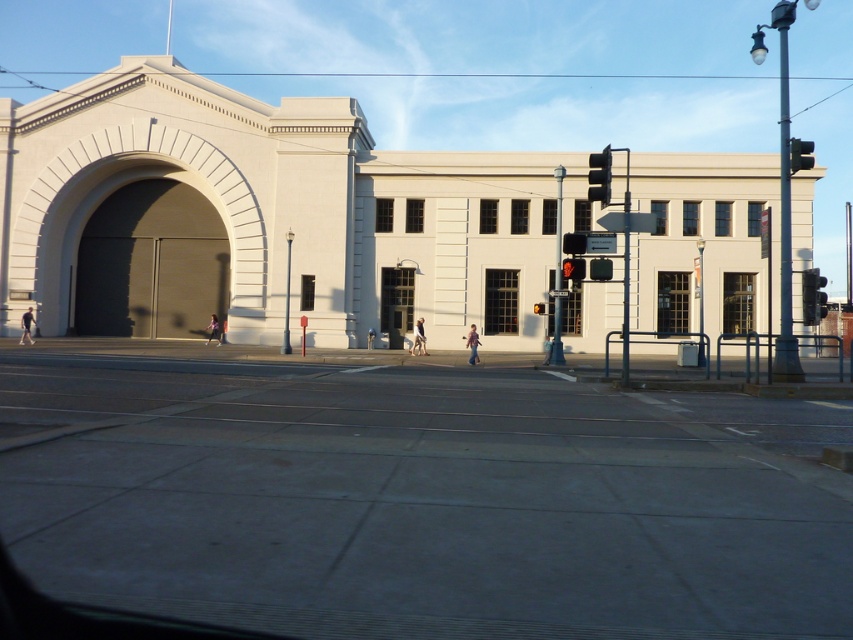
Can you confirm if black glass traffic light at right is positioned below metallic traffic light at upper right?

Yes, black glass traffic light at right is below metallic traffic light at upper right.

Between black glass traffic light at right and metallic traffic light at upper right, which one appears on the left side from the viewer's perspective?

metallic traffic light at upper right is more to the left.

Where is `black glass traffic light at right`? Image resolution: width=853 pixels, height=640 pixels. black glass traffic light at right is located at coordinates (811, 296).

Which is above, black plastic traffic light at upper right or red glass traffic light at center?

Positioned higher is black plastic traffic light at upper right.

Who is taller, black plastic traffic light at upper right or red glass traffic light at center?

Standing taller between the two is black plastic traffic light at upper right.

The height and width of the screenshot is (640, 853). Find the location of `black plastic traffic light at upper right`. black plastic traffic light at upper right is located at coordinates (599, 177).

Based on the photo, is red glass traffic light at center positioned in front of amber glass traffic light at center?

That is True.

Which is in front, point (573, 275) or point (532, 310)?

Point (573, 275) is in front.

Where is `red glass traffic light at center`? The width and height of the screenshot is (853, 640). red glass traffic light at center is located at coordinates (573, 268).

Locate an element on the screen. The image size is (853, 640). red glass traffic light at center is located at coordinates (573, 268).